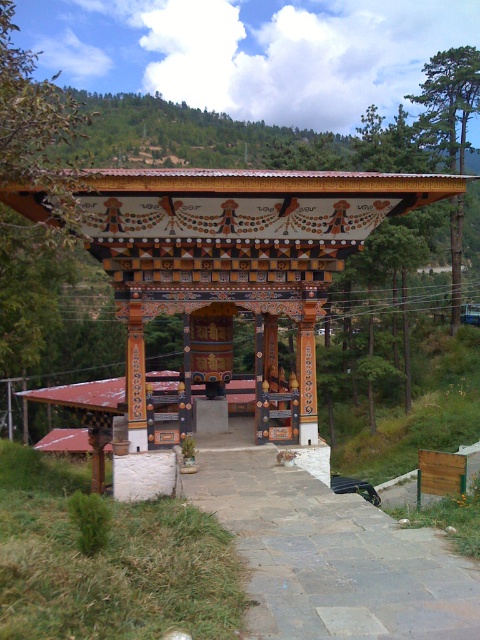
Question: Is painted wood gazebo at center to the left of gray stone path at center from the viewer's perspective?

Choices:
 (A) no
 (B) yes

Answer: (B)

Question: Is painted wood gazebo at center to the left of gray stone path at center from the viewer's perspective?

Choices:
 (A) yes
 (B) no

Answer: (A)

Question: Among these objects, which one is farthest from the camera?

Choices:
 (A) gray stone path at center
 (B) painted wood gazebo at center

Answer: (B)

Question: Where is painted wood gazebo at center located in relation to gray stone path at center in the image?

Choices:
 (A) above
 (B) below

Answer: (A)